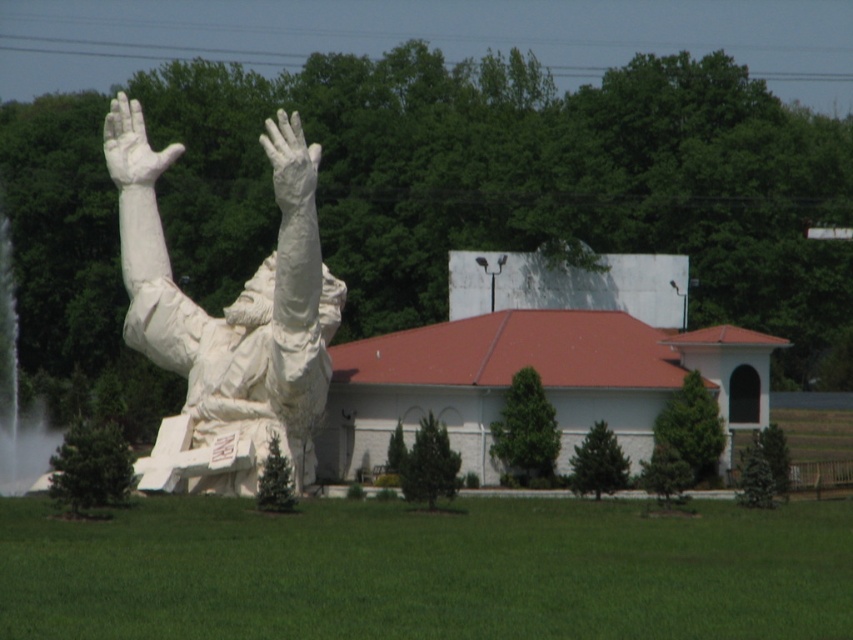
Question: Is white marble statue at center above white frothy water at left?

Choices:
 (A) no
 (B) yes

Answer: (B)

Question: Which object is positioned farthest from the white stone hand at upper center?

Choices:
 (A) white marble statue at center
 (B) white marble hand at upper center
 (C) white frothy water at left

Answer: (B)

Question: Which object appears farthest from the camera in this image?

Choices:
 (A) white marble statue at center
 (B) white stone hand at upper center
 (C) white frothy water at left
 (D) white marble hand at upper center

Answer: (B)

Question: Where is white marble statue at center located in relation to white stone hand at upper center in the image?

Choices:
 (A) right
 (B) left

Answer: (A)

Question: Does white frothy water at left appear on the left side of white marble hand at upper center?

Choices:
 (A) no
 (B) yes

Answer: (B)

Question: Which point is closer to the camera?

Choices:
 (A) white frothy water at left
 (B) white stone hand at upper center
 (C) white marble hand at upper center

Answer: (C)